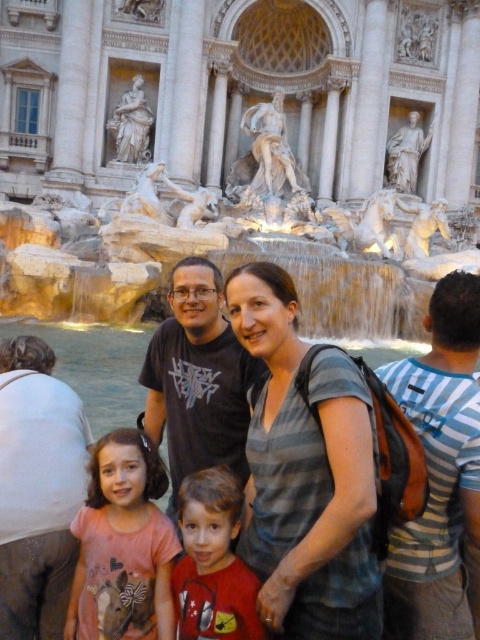
Question: Based on their relative distances, which object is nearer to the gray striped shirt at center?

Choices:
 (A) matte black t-shirt at center
 (B) red matte shirt at center

Answer: (B)

Question: Can you confirm if red matte shirt at center is positioned to the left of matte black t-shirt at center?

Choices:
 (A) no
 (B) yes

Answer: (A)

Question: Which is farther from the gray striped shirt at center?

Choices:
 (A) white marble fountain at center
 (B) pink matte shirt at center
 (C) matte black t-shirt at center
 (D) red matte shirt at center

Answer: (A)

Question: Which point appears farthest from the camera in this image?

Choices:
 (A) (226, 600)
 (B) (315, 484)
 (C) (411, 257)

Answer: (C)

Question: Does white marble fountain at center come behind pink matte shirt at center?

Choices:
 (A) yes
 (B) no

Answer: (A)

Question: From the image, what is the correct spatial relationship of gray striped shirt at center in relation to pink matte shirt at center?

Choices:
 (A) left
 (B) right

Answer: (B)